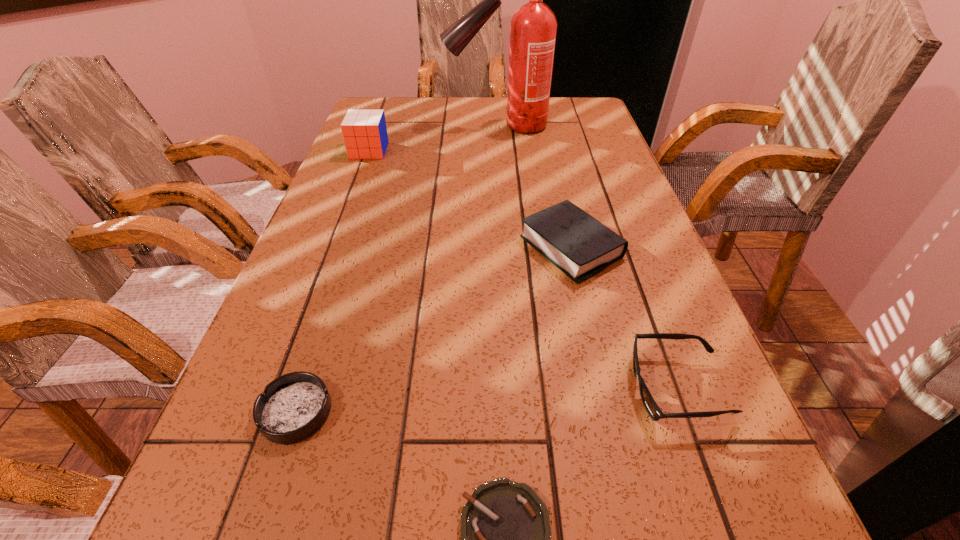
This screenshot has width=960, height=540. Identify the location of the third closest object relative to the sunglasses. (294, 406).

I want to click on object identified as the second closest to the Bible, so click(505, 528).